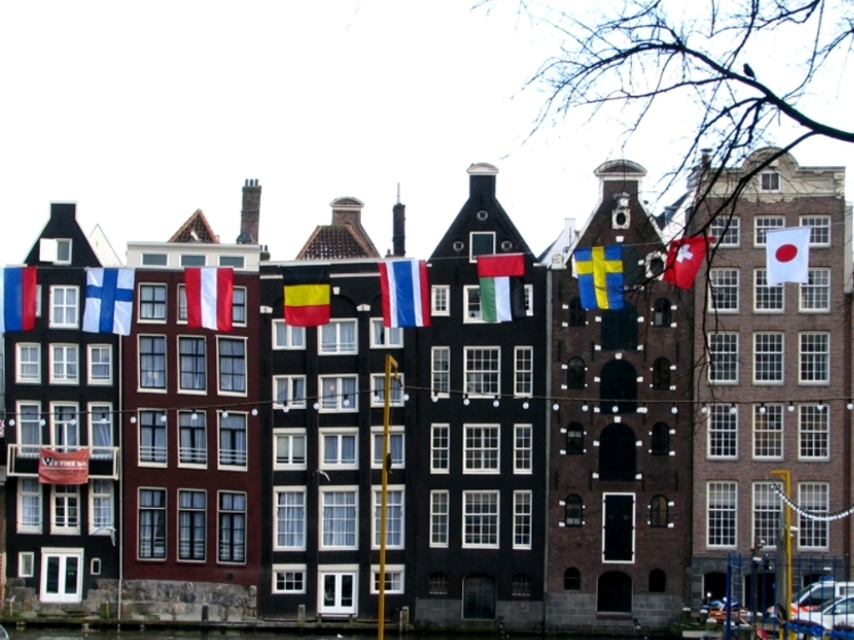
Does point (607, 260) come behind point (501, 269)?

No, it is in front of (501, 269).

Locate an element on the screen. The height and width of the screenshot is (640, 854). yellowmaterial/textureflag at center is located at coordinates (600, 276).

Does point (600, 307) come in front of point (502, 307)?

Yes, it is in front of point (502, 307).

You are a GUI agent. You are given a task and a screenshot of the screen. Output one action in this format:
    pyautogui.click(x=<x>, y=<y>)
    Task: Click on the yellowmaterial/textureflag at center
    The height and width of the screenshot is (640, 854).
    Given the screenshot: What is the action you would take?
    pyautogui.click(x=600, y=276)

Can you confirm if matte red flag at center is wider than matte red flag at lower left?

Correct, the width of matte red flag at center exceeds that of matte red flag at lower left.

Does matte red flag at center have a smaller size compared to matte red flag at lower left?

No.

Is point (205, 269) less distant than point (83, 452)?

Yes, it is in front of point (83, 452).

Locate an element on the screen. This screenshot has width=854, height=640. matte red flag at center is located at coordinates (208, 298).

Is green fabric flag at center wider than matte red flag at lower left?

Indeed, green fabric flag at center has a greater width compared to matte red flag at lower left.

The image size is (854, 640). What are the coordinates of `green fabric flag at center` in the screenshot? It's located at (500, 285).

Identify the location of green fabric flag at center. (500, 285).